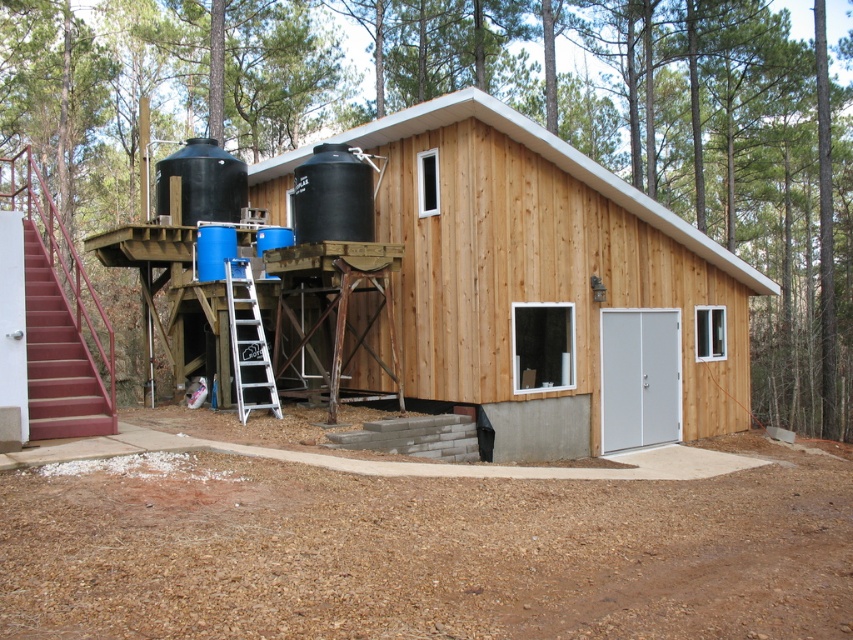
Does black matte water tank at upper center have a larger size compared to black matte water tank at upper left?

Indeed, black matte water tank at upper center has a larger size compared to black matte water tank at upper left.

Does point (345, 164) lie behind point (183, 188)?

No, (345, 164) is in front of (183, 188).

This screenshot has height=640, width=853. Describe the element at coordinates (332, 196) in the screenshot. I see `black matte water tank at upper center` at that location.

This screenshot has width=853, height=640. What are the coordinates of `black matte water tank at upper center` in the screenshot? It's located at (x=332, y=196).

Between natural wood cabin at center and black matte water tank at upper left, which one has more height?

black matte water tank at upper left is taller.

Is natural wood cabin at center above black matte water tank at upper left?

Incorrect, natural wood cabin at center is not positioned above black matte water tank at upper left.

Is point (454, 186) behind point (245, 172)?

No, it is in front of (245, 172).

Where is `natural wood cabin at center`? The height and width of the screenshot is (640, 853). natural wood cabin at center is located at coordinates (549, 282).

Can you confirm if black matte water tank at upper left is smaller than white aluminum ladder at center?

Correct, black matte water tank at upper left occupies less space than white aluminum ladder at center.

Looking at this image, who is more distant from viewer, (227, 156) or (270, 364)?

The point (227, 156) is behind.

Where is `black matte water tank at upper left`? The height and width of the screenshot is (640, 853). black matte water tank at upper left is located at coordinates (202, 182).